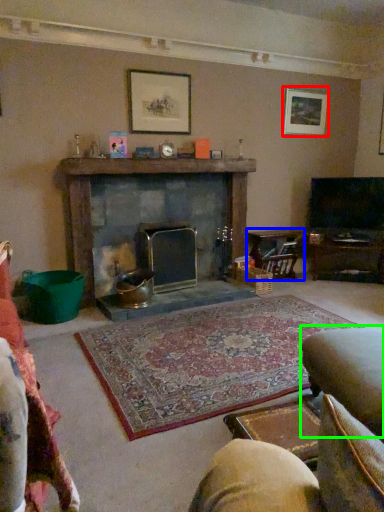
Question: Which object is the farthest from picture frame (highlighted by a red box)? Choose among these: table (highlighted by a blue box) or swivel chair (highlighted by a green box).

Choices:
 (A) table
 (B) swivel chair

Answer: (B)